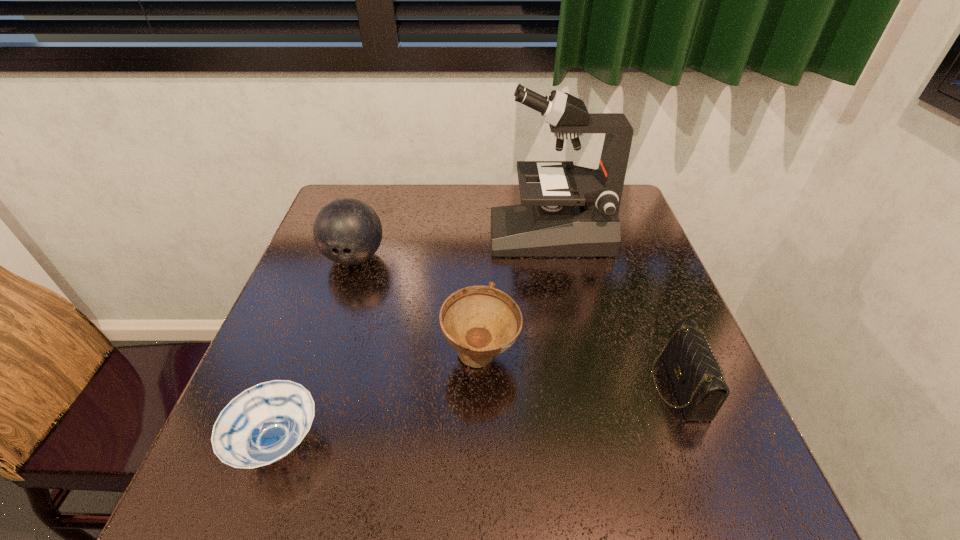
What are the coordinates of `vacant region between the fourth shortest object and the farther soup bowl` in the screenshot? It's located at (418, 307).

You are a GUI agent. You are given a task and a screenshot of the screen. Output one action in this format:
    pyautogui.click(x=<x>, y=<y>)
    Task: Click on the vacant space that is in between the third tallest object and the second tallest object
    
    Given the screenshot: What is the action you would take?
    pyautogui.click(x=418, y=307)

You are a GUI agent. You are given a task and a screenshot of the screen. Output one action in this format:
    pyautogui.click(x=<x>, y=<y>)
    Task: Click on the free area in between the bowling ball and the farther soup bowl
    
    Given the screenshot: What is the action you would take?
    pyautogui.click(x=418, y=307)

I want to click on free space between the bowling ball and the microscope, so click(x=452, y=246).

In order to click on free area in between the second tallest object and the third shortest object in this screenshot , I will do [418, 307].

Find the location of `free space between the microscope and the left soup bowl`. free space between the microscope and the left soup bowl is located at coordinates (414, 338).

The height and width of the screenshot is (540, 960). Identify the location of empty space that is in between the shorter soup bowl and the farther soup bowl. (379, 400).

The image size is (960, 540). Find the location of `free point between the clutch bag and the right soup bowl`. free point between the clutch bag and the right soup bowl is located at coordinates (580, 370).

Where is `vacant space in between the shortest object and the third shortest object`? Image resolution: width=960 pixels, height=540 pixels. vacant space in between the shortest object and the third shortest object is located at coordinates (379, 400).

Locate which object is the third closest to the second tallest object. Please provide its 2D coordinates. Your answer should be formatted as a tuple, i.e. [(x, y)], where the tuple contains the x and y coordinates of a point satisfying the conditions above.

[(265, 423)]